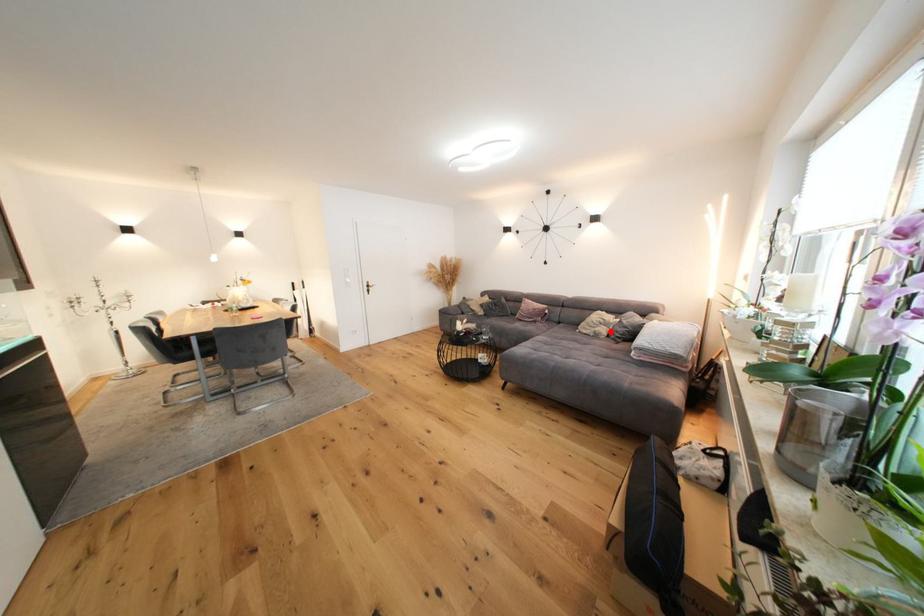
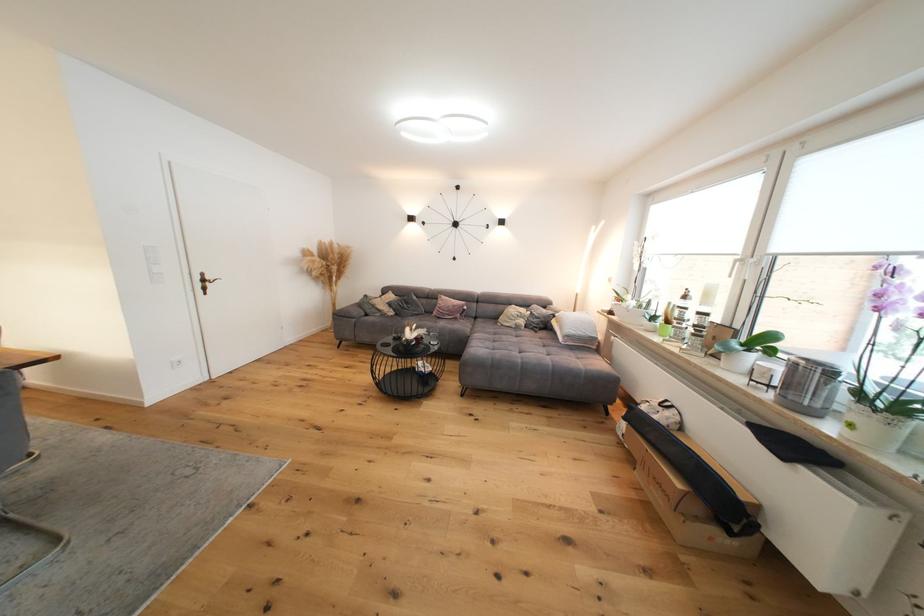
In the second image, find the point that corresponds to the highlighted location in the first image.

(529, 323)